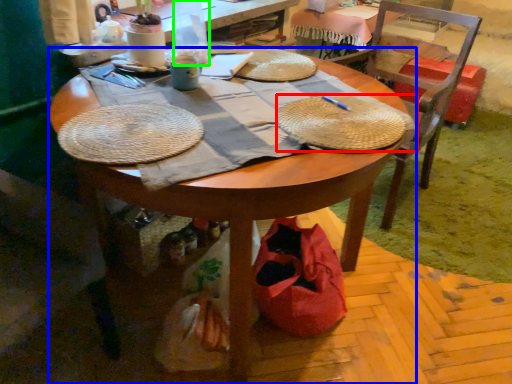
Question: Which object is the closest to the picnic basket (highlighted by a red box)? Choose among these: desk (highlighted by a blue box) or bottle (highlighted by a green box).

Choices:
 (A) desk
 (B) bottle

Answer: (A)